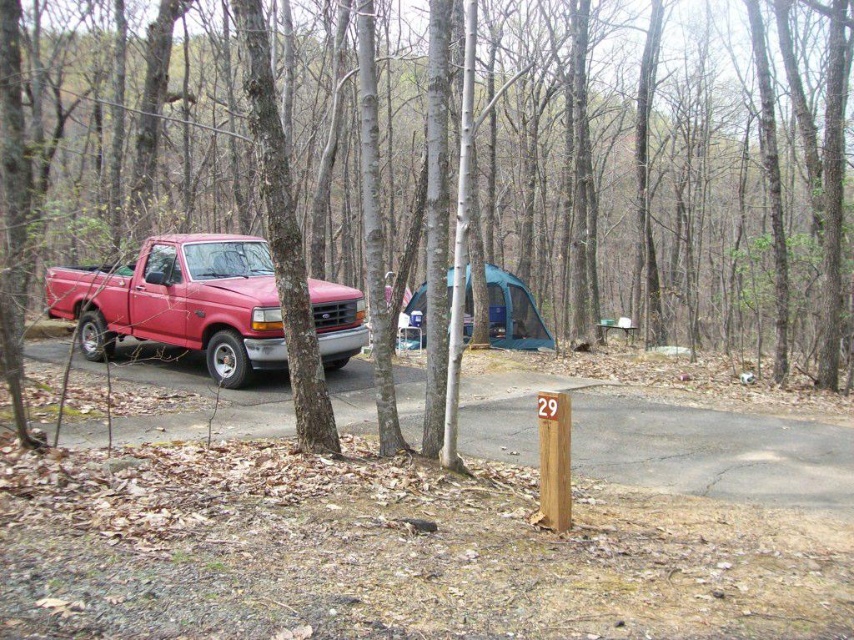
Looking at this image, can you confirm if smooth bark tree at center is wider than matte red truck at left?

Yes, smooth bark tree at center is wider than matte red truck at left.

Between point (683, 310) and point (229, 241), which one is positioned in front?

Positioned in front is point (229, 241).

Identify the location of smooth bark tree at center. (448, 180).

Does point (136, 326) come closer to viewer compared to point (410, 332)?

That is True.

Can you confirm if matte red truck at left is shorter than teal fabric tent at center?

Incorrect, matte red truck at left's height does not fall short of teal fabric tent at center's.

This screenshot has width=854, height=640. Find the location of `matte red truck at left`. matte red truck at left is located at coordinates (180, 301).

Based on the photo, who is more distant from viewer, (758, 332) or (469, 292)?

Positioned behind is point (469, 292).

How far apart are smooth bark tree at center and teal fabric tent at center?

A distance of 31.46 feet exists between smooth bark tree at center and teal fabric tent at center.

I want to click on smooth bark tree at center, so click(x=448, y=180).

Image resolution: width=854 pixels, height=640 pixels. Identify the location of smooth bark tree at center. (448, 180).